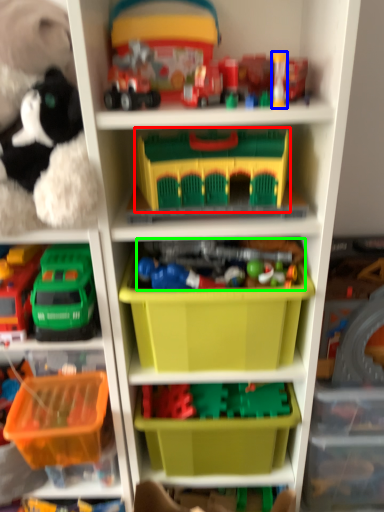
Question: Which is nearer to the toy (highlighted by a red box)? toy (highlighted by a blue box) or toy (highlighted by a green box).

Choices:
 (A) toy
 (B) toy

Answer: (B)